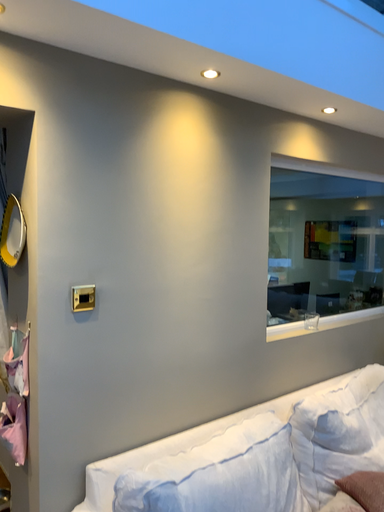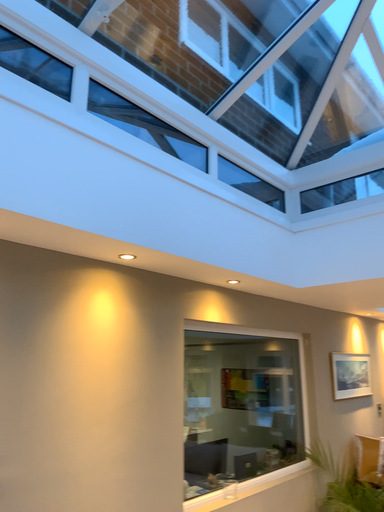
Question: Which way did the camera rotate in the video?

Choices:
 (A) rotated upward
 (B) rotated downward

Answer: (A)